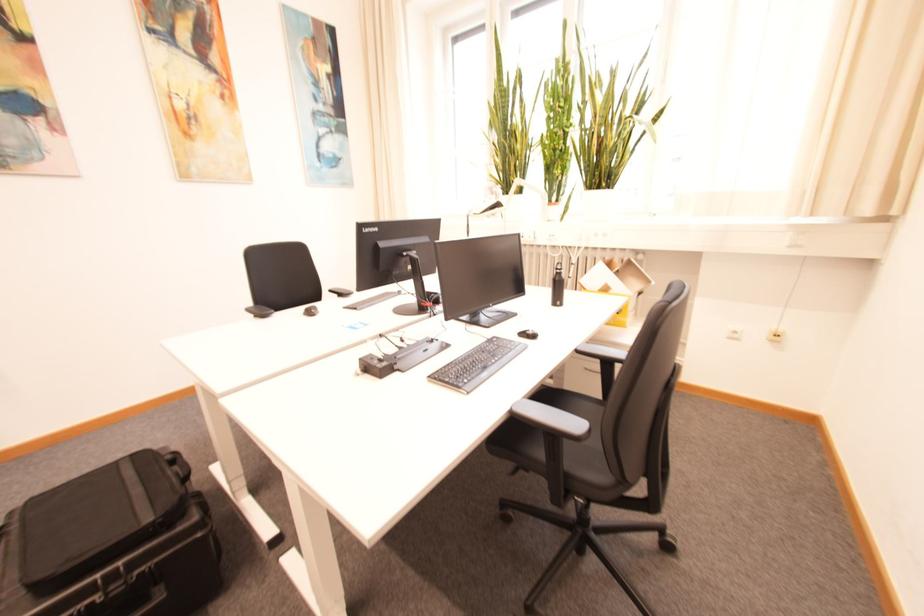
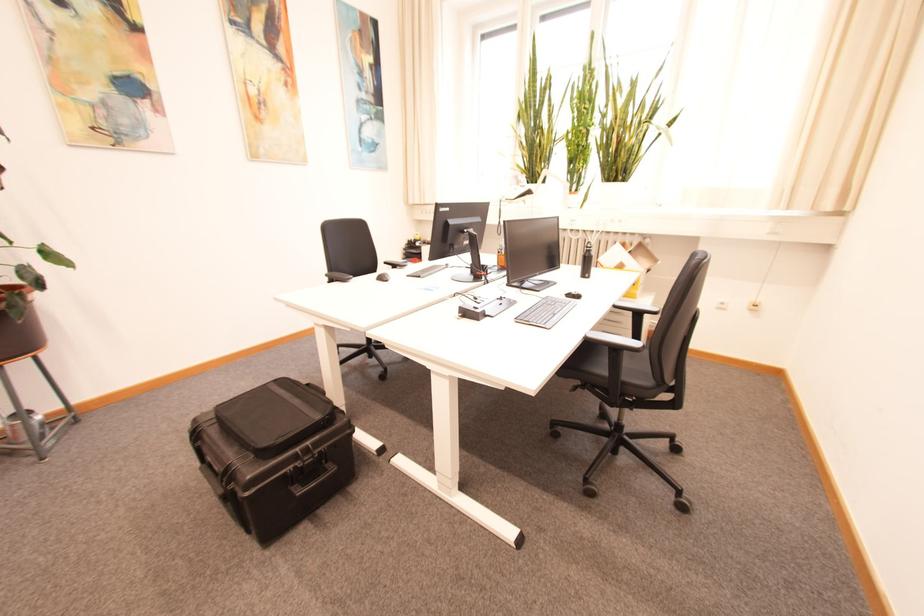
The point at (515, 408) is marked in the first image. Where is the corresponding point in the second image?

(590, 337)